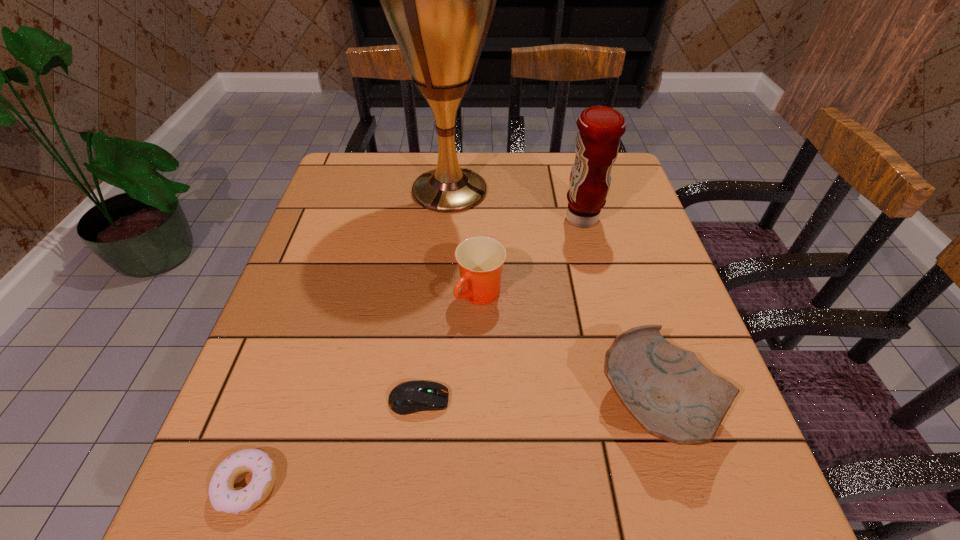
Locate an element on the screen. The image size is (960, 540). trophy cup is located at coordinates (439, 0).

Where is `the fifth shortest object`? This screenshot has height=540, width=960. the fifth shortest object is located at coordinates (597, 144).

This screenshot has height=540, width=960. Find the location of `cup`. cup is located at coordinates (480, 258).

You are a GUI agent. You are given a task and a screenshot of the screen. Output one action in this format:
    pyautogui.click(x=<x>, y=<y>)
    Task: Click on the fourth nearest object
    
    Given the screenshot: What is the action you would take?
    pyautogui.click(x=480, y=258)

Where is `pottery`? pottery is located at coordinates (668, 391).

Image resolution: width=960 pixels, height=540 pixels. Find the location of `computer equipment`. computer equipment is located at coordinates (408, 397).

Locate an element on the screen. The image size is (960, 540). the leftmost object is located at coordinates (224, 498).

Locate an element on the screen. The height and width of the screenshot is (540, 960). vacant space located 0.180m on the front of the trophy cup is located at coordinates (443, 269).

Identify the location of vacant space situated on the back of the condiment. (568, 166).

You are a GUI agent. You are given a task and a screenshot of the screen. Output one action in this format:
    pyautogui.click(x=<x>, y=<y>)
    Task: Click on the vacant space located 0.160m on the left of the cup
    The height and width of the screenshot is (540, 960).
    Given the screenshot: What is the action you would take?
    pyautogui.click(x=382, y=295)